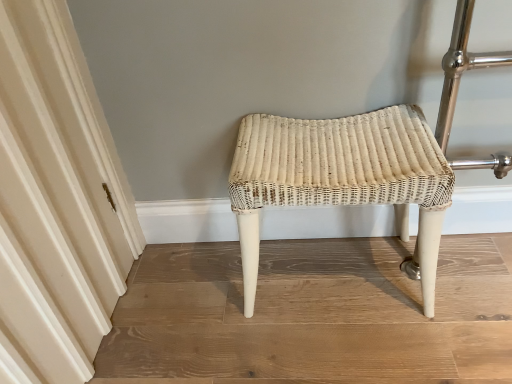
The height and width of the screenshot is (384, 512). I want to click on free space on the front side of white wicker stool at center, so pyautogui.click(x=356, y=349).